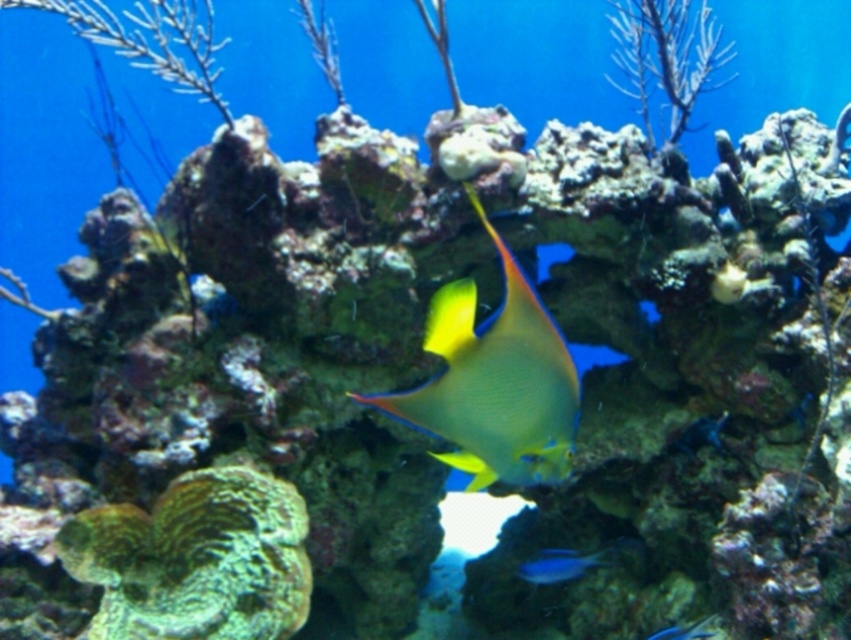
You are an underwater photographer aiming to capture both the yellow matte fish at center and the shiny blue fish at center in a single shot. Which fish should you focus on first to ensure both are in frame, considering their sizes?

The yellow matte fish at center is taller than the shiny blue fish at center, so you should focus on the yellow matte fish at center first to ensure both are in frame, as it requires more space due to its larger size.

You are an underwater photographer aiming to capture both the blue glossy fish at center and the shiny blue fish at center in a single frame. Given their sizes, which fish should you focus on to ensure both fit comfortably in the shot?

The blue glossy fish at center is wider than the shiny blue fish at center. To ensure both fit comfortably in the shot, focus on the blue glossy fish at center as it occupies more space, allowing the smaller shiny blue fish at center to fit alongside.

You are an underwater photographer aiming to capture the blue glossy fish at center and the shiny blue fish at center in a single shot. Which fish appears closer to your camera lens?

The blue glossy fish at center appears closer to the camera lens because it is further to the viewer than the shiny blue fish at center.